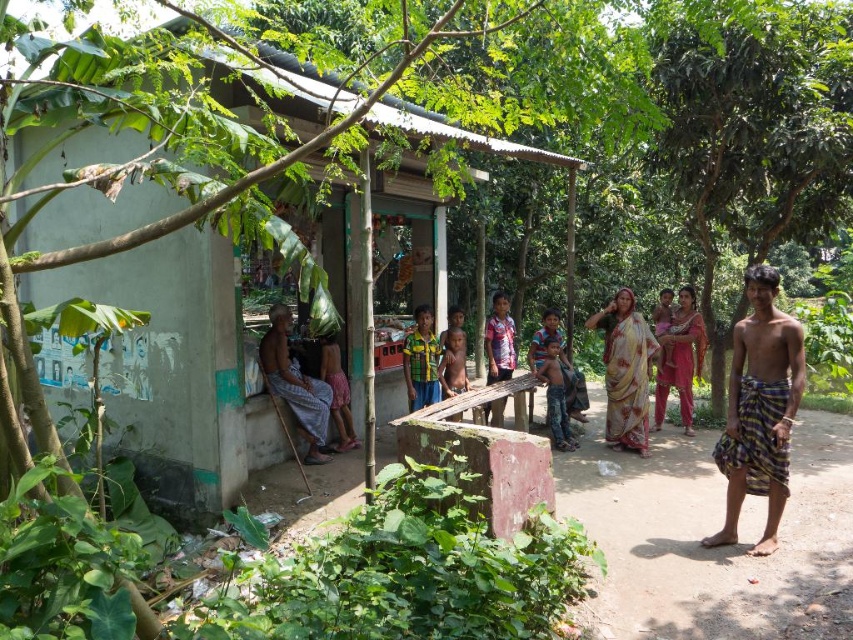
Question: Considering the real-world distances, which object is farthest from the green corrugated metal hut at center?

Choices:
 (A) green leafy tree at right
 (B) striped cotton sarong at right

Answer: (A)

Question: Does green corrugated metal hut at center have a larger size compared to striped cotton sarong at right?

Choices:
 (A) no
 (B) yes

Answer: (B)

Question: Which object appears farthest from the camera in this image?

Choices:
 (A) checkered fabric shirt at center
 (B) light brown fabric at center
 (C) green corrugated metal hut at center

Answer: (A)

Question: Which object appears closest to the camera in this image?

Choices:
 (A) light brown fabric at center
 (B) checkered fabric shirt at center

Answer: (A)

Question: Can you confirm if multicolored fabric shirt at center is positioned to the left of blue striped shirt at center?

Choices:
 (A) yes
 (B) no

Answer: (A)

Question: Can you confirm if light brown wooden chair at lower left is positioned above blue striped shirt at center?

Choices:
 (A) yes
 (B) no

Answer: (A)